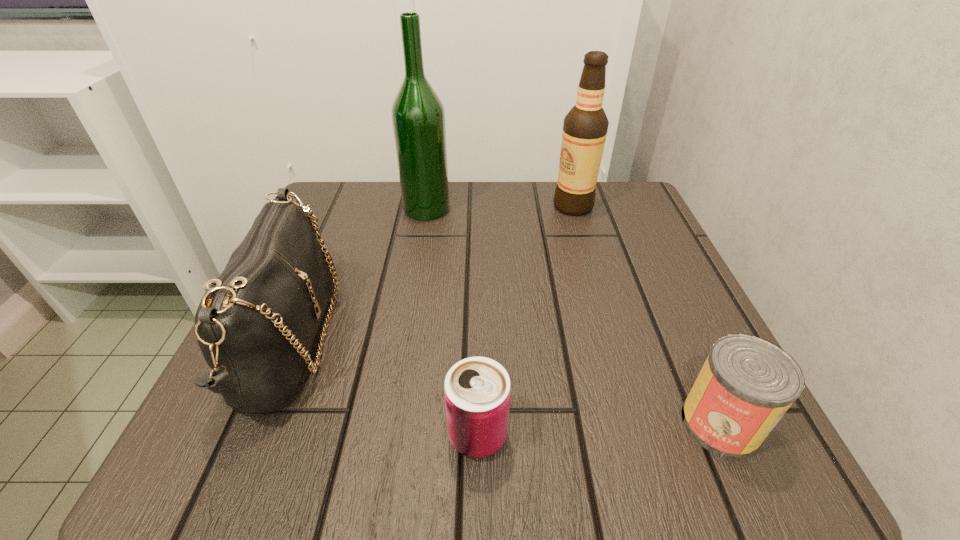
Identify the location of the fourth object from right to left. (418, 117).

Where is `the taller alcohol`? The width and height of the screenshot is (960, 540). the taller alcohol is located at coordinates (418, 117).

Find the location of a particular element. The width and height of the screenshot is (960, 540). the fourth object from left to right is located at coordinates (585, 127).

You are a GUI agent. You are given a task and a screenshot of the screen. Output one action in this format:
    pyautogui.click(x=<x>, y=<y>)
    Task: Click on the fourth shortest object
    The height and width of the screenshot is (540, 960).
    Given the screenshot: What is the action you would take?
    pyautogui.click(x=585, y=127)

Locate an element on the screen. This screenshot has height=540, width=960. handbag is located at coordinates (255, 325).

What are the coordinates of `the third tallest object` in the screenshot? It's located at (255, 325).

Image resolution: width=960 pixels, height=540 pixels. I want to click on the rightmost object, so click(746, 385).

Image resolution: width=960 pixels, height=540 pixels. I want to click on the third object from right to left, so click(477, 390).

You are a GUI agent. You are given a task and a screenshot of the screen. Output one action in this format:
    pyautogui.click(x=<x>, y=<y>)
    Task: Click on the vacant space located on the right of the second object from left to right
    This screenshot has height=540, width=960.
    Given the screenshot: What is the action you would take?
    pyautogui.click(x=562, y=208)

This screenshot has width=960, height=540. I want to click on vacant space located 0.150m on the label of the right alcohol, so click(x=487, y=206).